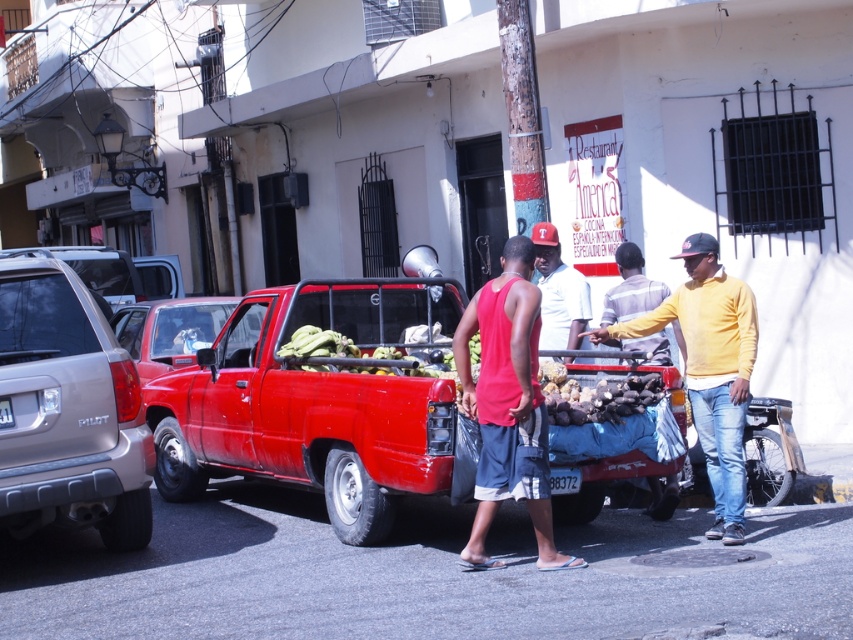
Which is in front, point (537, 300) or point (737, 339)?

Point (537, 300) is more forward.

Is point (525, 321) closer to viewer compared to point (718, 371)?

Yes, it is in front of point (718, 371).

Does point (483, 529) come behind point (701, 392)?

No.

Where is `red matte tank top at center`? The image size is (853, 640). red matte tank top at center is located at coordinates tap(508, 404).

In the scene shown: Is metallic red truck at center below dark brown textured potatoes at center?

No.

Is metallic red truck at center bigger than dark brown textured potatoes at center?

Yes.

Where is `metallic red truck at center`? metallic red truck at center is located at coordinates (169, 330).

Is shiny red truck at center below red matte tank top at center?

Correct, shiny red truck at center is located below red matte tank top at center.

Which is above, shiny red truck at center or red matte tank top at center?

red matte tank top at center is higher up.

Which is in front, point (383, 330) or point (503, 252)?

Positioned in front is point (503, 252).

Find the location of a particular element. The height and width of the screenshot is (640, 853). shiny red truck at center is located at coordinates (315, 401).